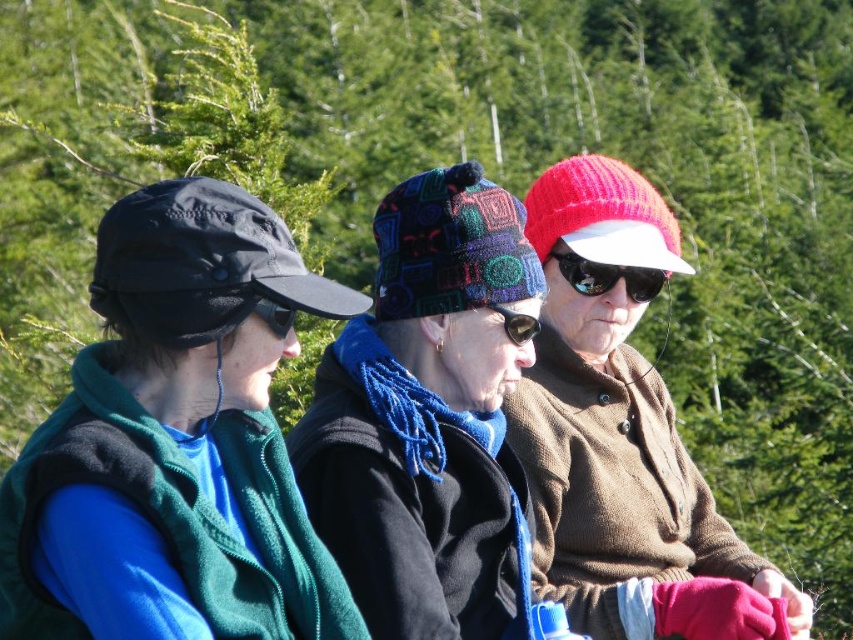
You are a photographer trying to capture a closeup shot of the knitted red hat at center and the black rubber goggles at center. Given that your camera can only focus on objects within a 4.5 feet range, will you be able to include both items in the same frame without moving the camera?

The distance between the knitted red hat at center and the black rubber goggles at center is 5.03 feet, which exceeds the camera focus range of 4.5 feet. Therefore, you cannot include both items in the same frame without moving the camera.

You are a photographer trying to capture a clear shot of the black reflective sunglasses at center and the black matte goggles at center. However, the sunglasses are blocking the view of the goggles. Can you adjust your angle to see both items without obstruction?

The black reflective sunglasses at center is positioned over black matte goggles at center, so adjusting your angle downward might allow you to see both items without obstruction.